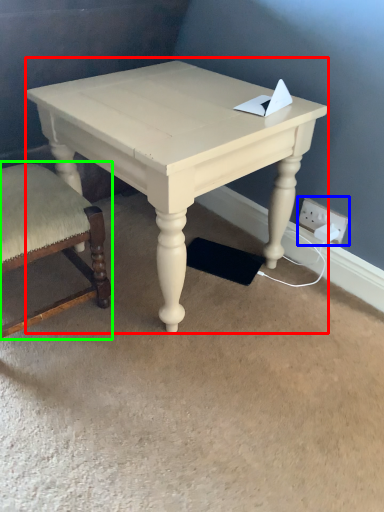
Question: Estimate the real-world distances between objects in this image. Which object is closer to table (highlighted by a red box), electric outlet (highlighted by a blue box) or chair (highlighted by a green box)?

Choices:
 (A) electric outlet
 (B) chair

Answer: (B)